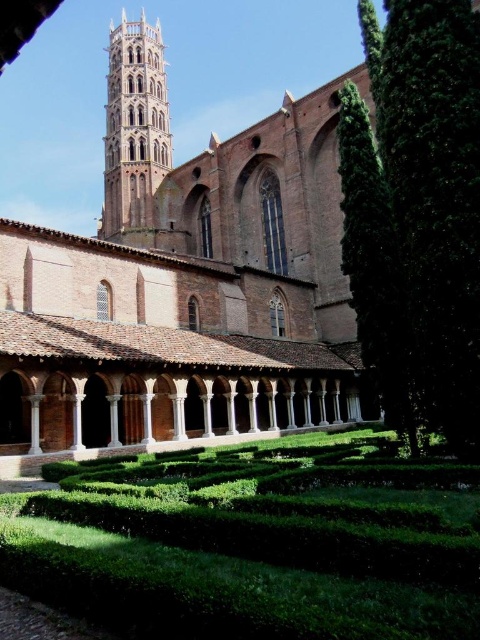
Question: From the image, what is the correct spatial relationship of green hedge maze at lower center in relation to green leafy hedge at right?

Choices:
 (A) below
 (B) above

Answer: (A)

Question: Which of these objects is positioned closest to the green hedge maze at lower center?

Choices:
 (A) brown brick church at center
 (B) brown brick tower at upper left
 (C) green leafy hedge at right

Answer: (C)

Question: Which of the following is the closest to the observer?

Choices:
 (A) green hedge maze at lower center
 (B) brown brick tower at upper left
 (C) brown brick church at center

Answer: (A)

Question: Can you confirm if brown brick church at center is positioned to the left of green leafy hedge at right?

Choices:
 (A) yes
 (B) no

Answer: (A)

Question: Is green hedge maze at lower center wider than brown brick tower at upper left?

Choices:
 (A) yes
 (B) no

Answer: (A)

Question: Which point is farther to the camera?

Choices:
 (A) (464, 264)
 (B) (152, 131)
 (C) (178, 513)
 (D) (472, 4)

Answer: (B)